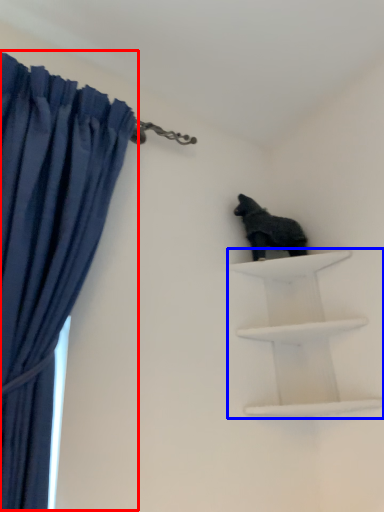
Question: Which object appears closest to the camera in this image, curtain (highlighted by a red box) or shelf (highlighted by a blue box)?

Choices:
 (A) curtain
 (B) shelf

Answer: (A)